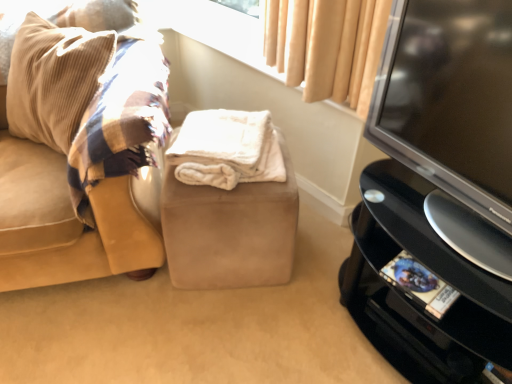
Find the location of a particular element. vacant space to the right of suede beige stool at center is located at coordinates (317, 249).